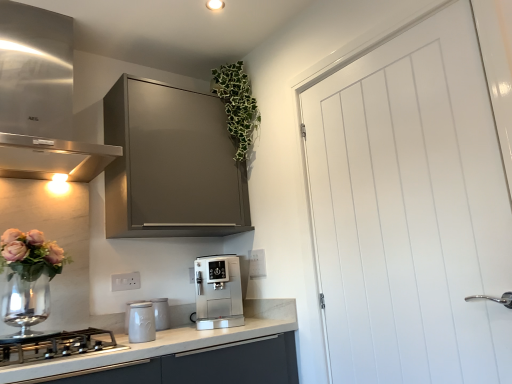
Question: Can you confirm if matte gray cabinet at upper center is taller than satin silver coffee machine at center, placed as the fourth kitchen appliance when sorted from left to right?

Choices:
 (A) no
 (B) yes

Answer: (B)

Question: Does matte gray cabinet at upper center have a larger size compared to satin silver coffee machine at center, placed as the fourth kitchen appliance when sorted from left to right?

Choices:
 (A) yes
 (B) no

Answer: (A)

Question: Could you tell me if matte gray cabinet at upper center is turned towards satin silver coffee machine at center, placed as the fourth kitchen appliance when sorted from left to right?

Choices:
 (A) yes
 (B) no

Answer: (B)

Question: Would you say matte gray cabinet at upper center contains satin silver coffee machine at center, placed as the fourth kitchen appliance when sorted from left to right?

Choices:
 (A) yes
 (B) no

Answer: (B)

Question: Can you confirm if matte gray cabinet at upper center is thinner than satin silver coffee machine at center, placed as the fourth kitchen appliance when sorted from left to right?

Choices:
 (A) yes
 (B) no

Answer: (A)

Question: Is white ceramic canister at center, arranged as the 3th kitchen appliance when viewed from the right, taller or shorter than white plastic electric outlet at lower center, the first electric outlet in the front-to-back sequence?

Choices:
 (A) short
 (B) tall

Answer: (B)

Question: Considering their positions, is white ceramic canister at center, which ranks as the second kitchen appliance in left-to-right order, located in front of or behind white plastic electric outlet at lower center, which is the 2th electric outlet in right-to-left order?

Choices:
 (A) behind
 (B) front

Answer: (B)

Question: Is white ceramic canister at center, arranged as the 3th kitchen appliance when viewed from the right, inside or outside of white plastic electric outlet at lower center, the second electric outlet positioned from the back?

Choices:
 (A) inside
 (B) outside

Answer: (B)

Question: Considering the relative positions of white ceramic canister at center, arranged as the 3th kitchen appliance when viewed from the right, and white plastic electric outlet at lower center, the first electric outlet in the front-to-back sequence, in the image provided, is white ceramic canister at center, arranged as the 3th kitchen appliance when viewed from the right, to the left or to the right of white plastic electric outlet at lower center, the first electric outlet in the front-to-back sequence,?

Choices:
 (A) right
 (B) left

Answer: (A)

Question: Is white plastic electric outlet at lower center, which is the 2th electric outlet in right-to-left order, taller or shorter than white ceramic canister at center, arranged as the 3th kitchen appliance when viewed from the right?

Choices:
 (A) tall
 (B) short

Answer: (B)

Question: From the image's perspective, is white plastic electric outlet at lower center, the first electric outlet in the front-to-back sequence, located above or below white ceramic canister at center, arranged as the 3th kitchen appliance when viewed from the right?

Choices:
 (A) above
 (B) below

Answer: (A)

Question: In the image, is white plastic electric outlet at lower center, which is the 2th electric outlet in right-to-left order, positioned in front of or behind white ceramic canister at center, which ranks as the second kitchen appliance in left-to-right order?

Choices:
 (A) behind
 (B) front

Answer: (A)

Question: Which is correct: white plastic electric outlet at lower center, which is the 2th electric outlet in right-to-left order, is inside white ceramic canister at center, arranged as the 3th kitchen appliance when viewed from the right, or outside of it?

Choices:
 (A) outside
 (B) inside

Answer: (A)

Question: From their relative heights in the image, would you say white smooth door at right is taller or shorter than satin silver coffee machine at center, placed as the 1th kitchen appliance when sorted from right to left?

Choices:
 (A) short
 (B) tall

Answer: (B)

Question: Do you think white smooth door at right is within satin silver coffee machine at center, placed as the fourth kitchen appliance when sorted from left to right, or outside of it?

Choices:
 (A) inside
 (B) outside

Answer: (B)